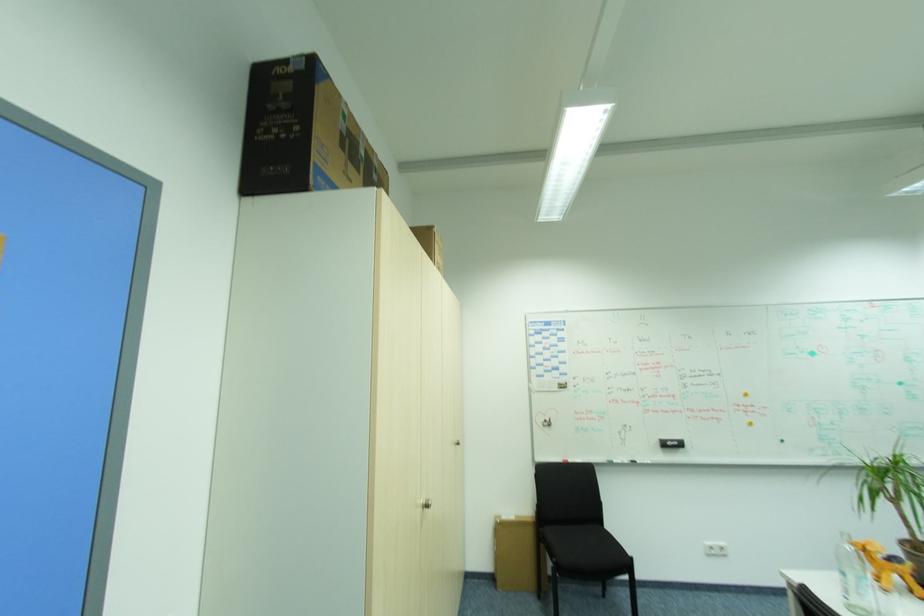
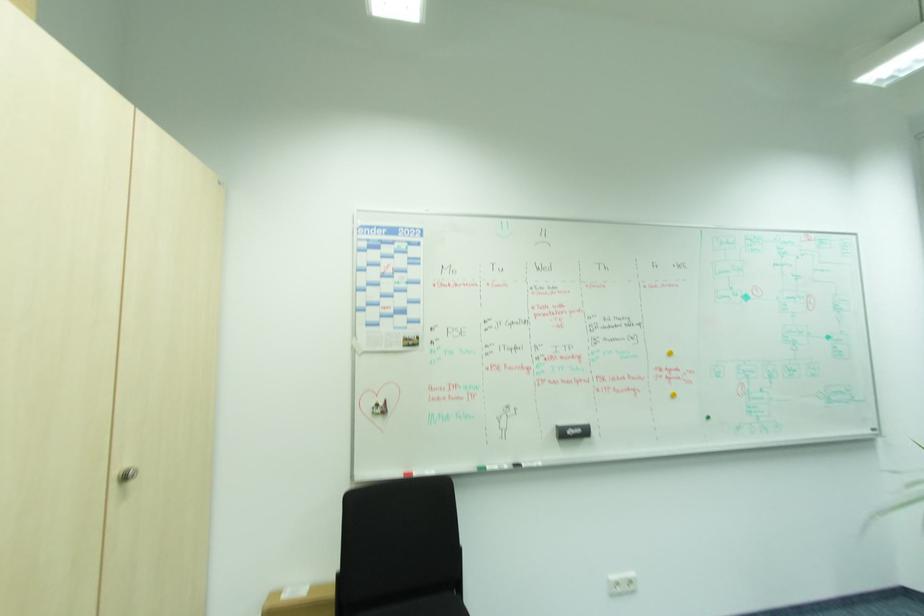
In a continuous first-person perspective shot, in which direction is the camera moving?

The cameraman moved toward right, forward.